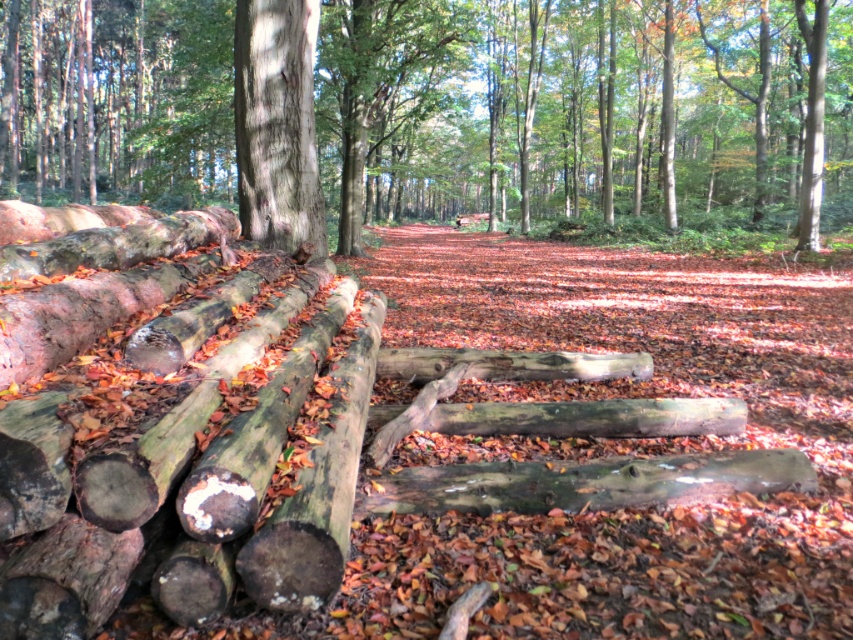
You are standing in the forest and want to reach a specific point marked as point (360, 170). If your walking speed is 1.5 meters per second, how many seconds will it take you to reach that point?

The point (360, 170) is 14.37 meters away from the viewer. At a walking speed of 1.5 meters per second, it will take approximately 9.58 seconds to reach the point.

You are standing in the forest and see the smooth bark tree at center and the smooth gray bark at center. Which one is more to the left?

The smooth bark tree at center is positioned on the left side of smooth gray bark at center.

Consider the image. You are standing in the forest scene described. There is a point labeled at coordinates (581, 108). What does this point indicate?

The point at coordinates (581, 108) marks the location of the smooth bark tree at center.